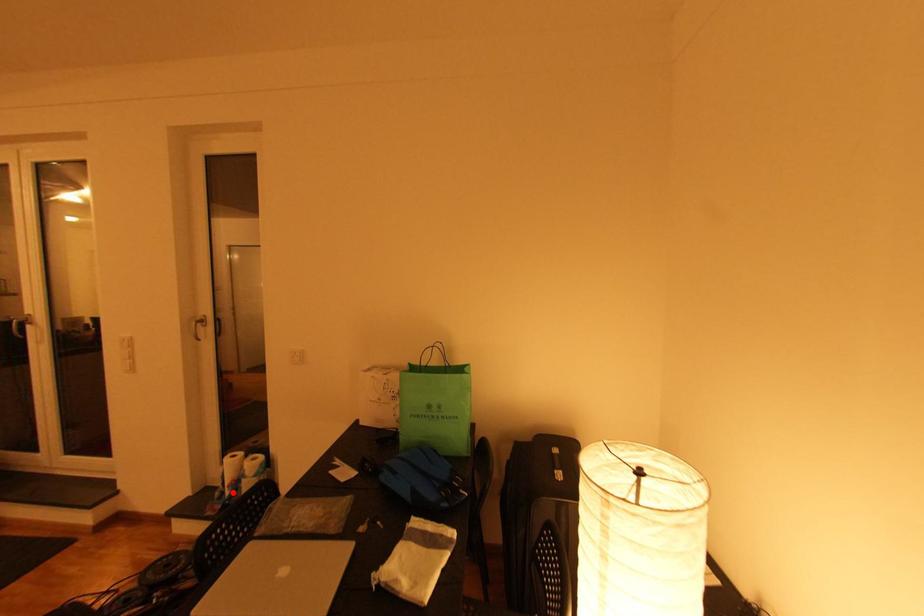
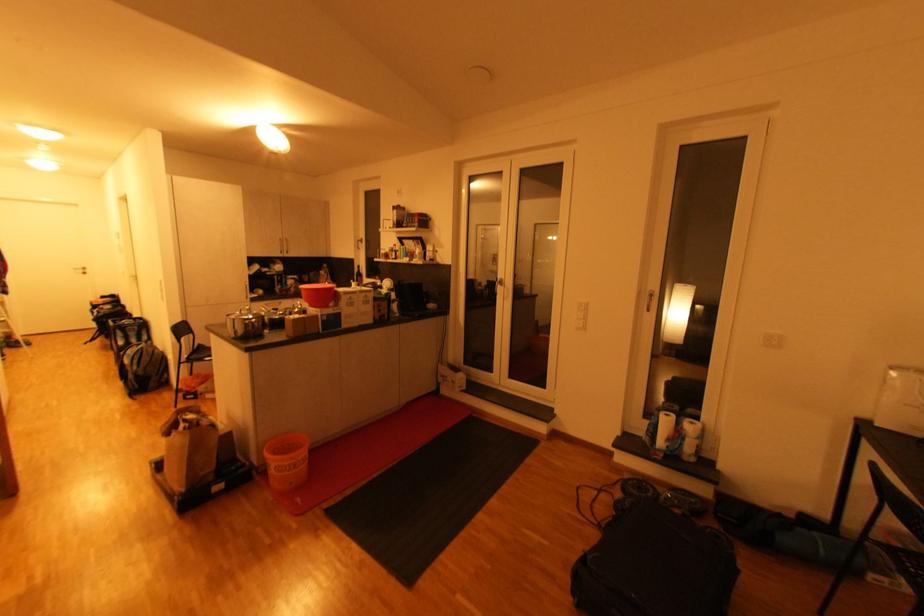
Question: A red point is marked in image1. In image2, is the corresponding 3D point closer to the camera or farther? Reply with the corresponding letter.

Choices:
 (A) The corresponding 3D point is closer.
 (B) The corresponding 3D point is farther.

Answer: (A)